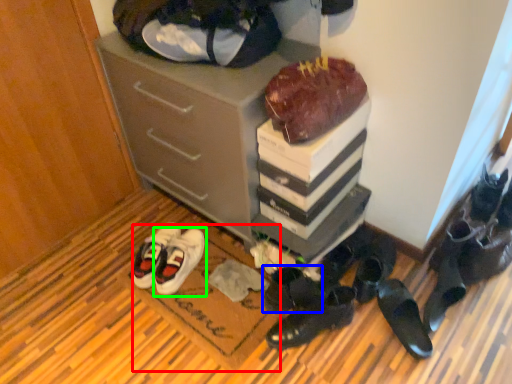
Question: Which is farther away from doormat (highlighted by a red box)? footwear (highlighted by a blue box) or footwear (highlighted by a green box)?

Choices:
 (A) footwear
 (B) footwear

Answer: (A)